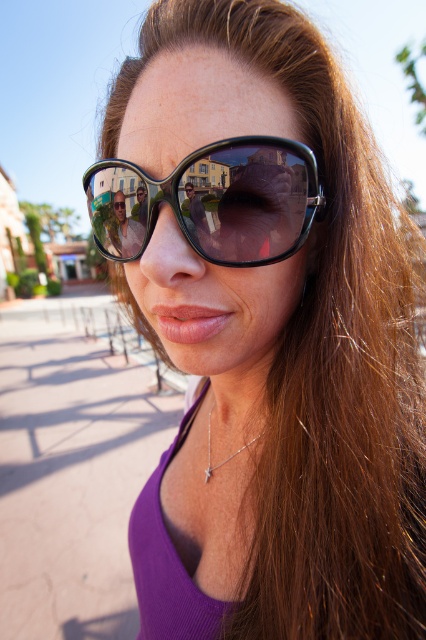
You are a photographer adjusting the focus of your camera. You need to focus on one of two points in the image, either point (245, 182) or point (120, 237). Which point should you choose to ensure the closest object is in focus?

Point (245, 182) is closer to the camera than point (120, 237), so you should choose point (245, 182) to ensure the closest object is in focus.

What are the coordinates of the black plastic sunglasses at center?

The black plastic sunglasses at center are located at coordinates point (212, 202).